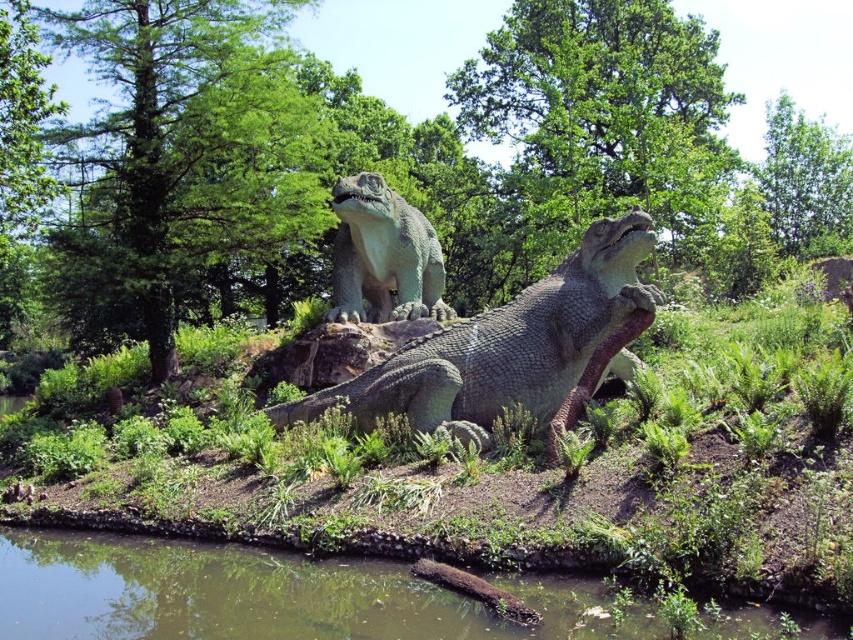
Question: Which of the following is the farthest from the observer?

Choices:
 (A) greenish water at lower center
 (B) green textured statue at center

Answer: (B)

Question: Considering the real-world distances, which object is closest to the green textured statue at center?

Choices:
 (A) smooth gray crocodile at center
 (B) greenish water at lower center

Answer: (A)

Question: Observing the image, what is the correct spatial positioning of smooth gray crocodile at center in reference to green textured statue at center?

Choices:
 (A) below
 (B) above

Answer: (A)

Question: Among these points, which one is nearest to the camera?

Choices:
 (A) (387, 298)
 (B) (506, 396)
 (C) (67, 579)

Answer: (C)

Question: Can you confirm if smooth gray crocodile at center is bigger than green textured statue at center?

Choices:
 (A) yes
 (B) no

Answer: (A)

Question: Does smooth gray crocodile at center have a lesser width compared to green textured statue at center?

Choices:
 (A) yes
 (B) no

Answer: (B)